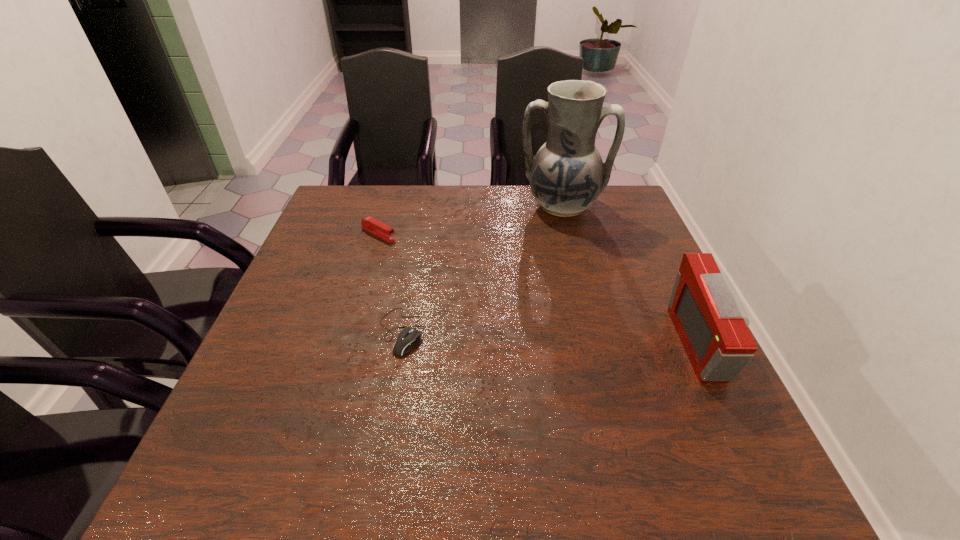
Locate an element on the screen. The height and width of the screenshot is (540, 960). free space on the desktop that is between the second object from left to right and the camera and is positioned on the front-facing side of the tallest object is located at coordinates (542, 338).

The width and height of the screenshot is (960, 540). I want to click on vacant spot on the desktop that is between the shortest object and the rightmost object and is positioned on the front-facing side of the stapler, so click(584, 339).